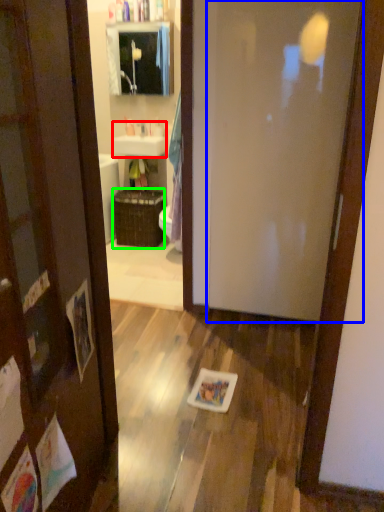
Question: Which object is positioned farthest from sink (highlighted by a red box)? Select from door (highlighted by a blue box) and basket (highlighted by a green box).

Choices:
 (A) door
 (B) basket

Answer: (A)